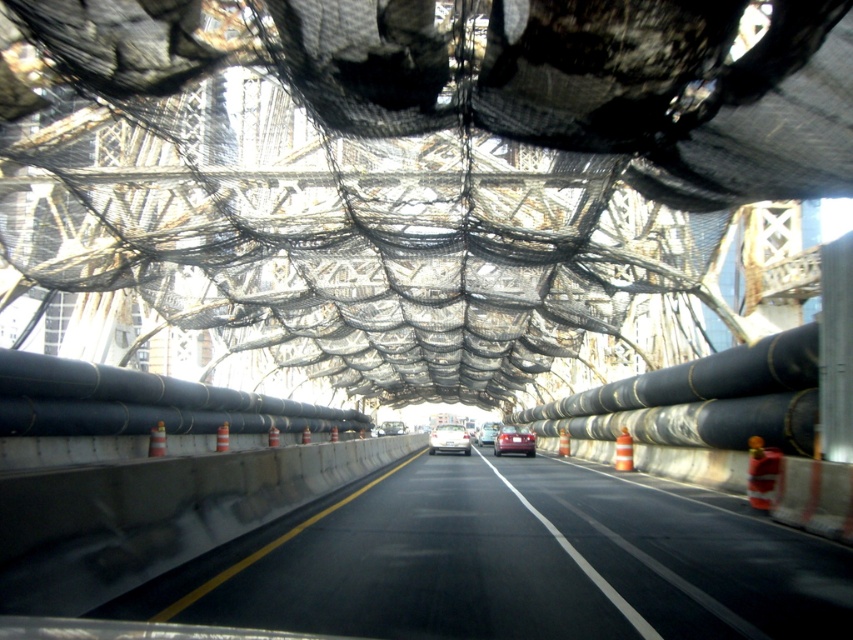
Which is more to the right, orange striped traffic cone at center or shiny red car at center?

From the viewer's perspective, orange striped traffic cone at center appears more on the right side.

What do you see at coordinates (624, 451) in the screenshot? The image size is (853, 640). I see `orange striped traffic cone at center` at bounding box center [624, 451].

In order to click on orange striped traffic cone at center in this screenshot , I will do `click(624, 451)`.

Who is more forward, (495, 426) or (399, 420)?

Point (495, 426) is in front.

This screenshot has width=853, height=640. I want to click on shiny red car at center, so click(x=488, y=433).

Does point (440, 432) lie behind point (393, 422)?

That is False.

Does point (444, 445) lie in front of point (392, 433)?

That is True.

The height and width of the screenshot is (640, 853). Describe the element at coordinates (450, 438) in the screenshot. I see `white glossy sedan at center` at that location.

The height and width of the screenshot is (640, 853). Identify the location of white glossy sedan at center. (450, 438).